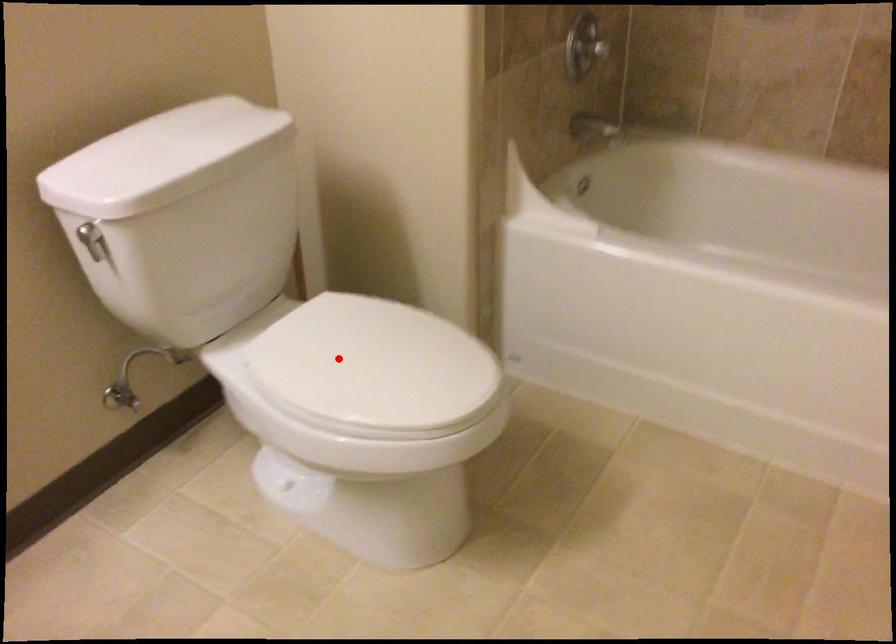
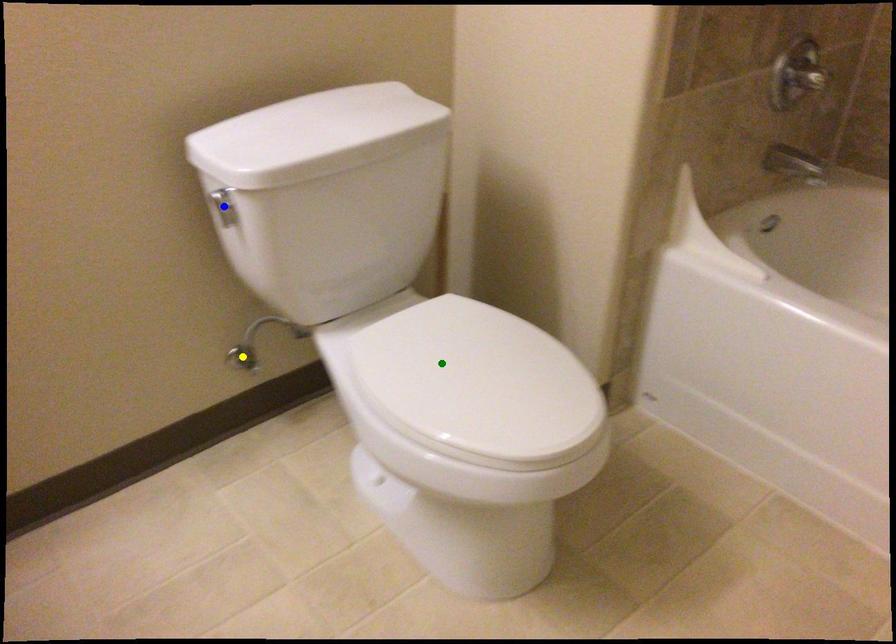
Question: I am providing you with two images of the same scene from different viewpoints. A red point is marked on the first image. You are given multiple points on the second image. Can you choose the point in image 2 that corresponds to the point in image 1?

Choices:
 (A) blue point
 (B) yellow point
 (C) green point

Answer: (C)